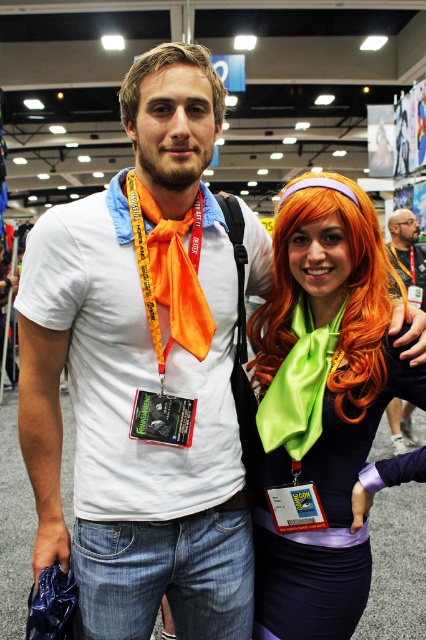
You are an event organizer at the convention. You notice two green items at the center of the image. Which one is closer to you, the green satin scarf at center or the green satin lanyard at center?

The green satin scarf at center is in front of the green satin lanyard at center, so the green satin scarf at center is closer to you.

You are attending a convention and notice two lanyards hanging from the center of a booth. The green satin lanyard at center and the yellow fabric lanyard at center. Which lanyard is smaller in size?

The green satin lanyard at center is smaller than the yellow fabric lanyard at center.